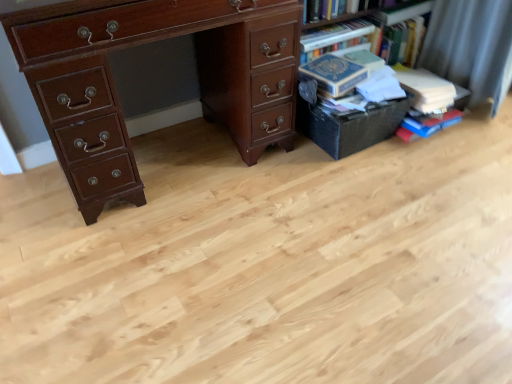
Describe the element at coordinates (350, 125) in the screenshot. This screenshot has height=384, width=512. I see `black matte box at right` at that location.

Where is `hardcover book at right, the 2th book positioned from the right`? hardcover book at right, the 2th book positioned from the right is located at coordinates (353, 77).

Can you confirm if matte brown desk at left is bigger than black matte box at right?

Yes, matte brown desk at left is bigger than black matte box at right.

Does point (6, 0) come in front of point (358, 139)?

Yes, point (6, 0) is closer to viewer.

What are the coordinates of `drawer that appears behind the matte brown desk at left` in the screenshot? It's located at (350, 125).

Is matte brown desk at left wider or thinner than black matte box at right?

Considering their sizes, matte brown desk at left looks broader than black matte box at right.

Is hardcover book at right, acting as the 1th book starting from the right, oriented away from black matte box at right?

No, hardcover book at right, acting as the 1th book starting from the right,'s orientation is not away from black matte box at right.

Between point (412, 134) and point (354, 112), which one is positioned in front?

The point (354, 112) is closer to the camera.

From a real-world perspective, which object stands above the other?

hardcover book at right, the second book viewed from the left.

Is hardcover book at right, the second book viewed from the left, touching black matte box at right?

No, hardcover book at right, the second book viewed from the left, is not touching black matte box at right.

Is the depth of hardcover books at upper right greater than that of hardcover book at right, the second book viewed from the left?

Yes, hardcover books at upper right is further from the viewer.

Is point (413, 0) farther from camera compared to point (417, 82)?

Yes, it is.

In the scene shown: From a real-world perspective, who is located higher, hardcover books at upper right or hardcover book at right, acting as the 1th book starting from the right?

From a 3D spatial view, hardcover books at upper right is above.

Are hardcover books at upper right and hardcover book at right, acting as the 1th book starting from the right, far apart?

Answer: hardcover books at upper right is near hardcover book at right, acting as the 1th book starting from the right, not far away.

Based on the photo, is hardcover books at upper right inside black matte box at right?

No.

Which of these two, black matte box at right or hardcover books at upper right, stands taller?

hardcover books at upper right.

Between point (317, 102) and point (355, 15), which one is positioned behind?

The point (355, 15) is behind.

Is black matte box at right oriented away from hardcover books at upper right?

Yes, hardcover books at upper right is at the back of black matte box at right.

Which is in front, point (315, 142) or point (408, 136)?

The point (315, 142) is more forward.

Is black matte box at right shorter than hardcover book at right, the second book viewed from the left?

No, black matte box at right is not shorter than hardcover book at right, the second book viewed from the left.

Which object is wider, black matte box at right or hardcover book at right, acting as the 1th book starting from the right?

With larger width is hardcover book at right, acting as the 1th book starting from the right.

Between black matte box at right and hardcover book at right, acting as the 1th book starting from the right, which one appears on the right side from the viewer's perspective?

hardcover book at right, acting as the 1th book starting from the right.

Is matte brown desk at left situated inside hardcover books at upper right or outside?

matte brown desk at left is outside hardcover books at upper right.

Is point (117, 139) behind point (340, 18)?

No, (117, 139) is in front of (340, 18).

Where is `the chest of drawers located below the hardcover books at upper right (from the image's perspective)`? The height and width of the screenshot is (384, 512). the chest of drawers located below the hardcover books at upper right (from the image's perspective) is located at coordinates (142, 43).

Is point (423, 106) positioned behind point (344, 102)?

That is True.

Which object is further away from the camera, hardcover book at right, acting as the 1th book starting from the right, or hardcover book at right, positioned as the first book in left-to-right order?

hardcover book at right, acting as the 1th book starting from the right.

Between hardcover book at right, the second book viewed from the left, and hardcover book at right, positioned as the first book in left-to-right order, which one has larger width?

With larger width is hardcover book at right, the second book viewed from the left.

Is hardcover book at right, acting as the 1th book starting from the right, not near hardcover book at right, positioned as the first book in left-to-right order?

They are positioned close to each other.

Image resolution: width=512 pixels, height=384 pixels. Find the location of `chest of drawers above the black matte box at right (from the image's perspective)`. chest of drawers above the black matte box at right (from the image's perspective) is located at coordinates (142, 43).

At what (x,y) coordinates should I click in order to perform the action: click on drawer located underneath the hardcover book at right, the second book viewed from the left (from a real-world perspective). Please return your answer as a coordinate pair (x, y). Looking at the image, I should click on (350, 125).

Looking at the image, which one is located closer to hardcover book at right, the second book viewed from the left, matte brown desk at left or hardcover books at upper right?

hardcover books at upper right is closer to hardcover book at right, the second book viewed from the left.

Estimate the real-world distances between objects in this image. Which object is closer to black matte box at right, hardcover books at upper right or hardcover book at right, the 2th book positioned from the right?

Among the two, hardcover book at right, the 2th book positioned from the right, is located nearer to black matte box at right.

Based on their spatial positions, is matte brown desk at left or hardcover book at right, the second book viewed from the left, further from hardcover books at upper right?

Based on the image, matte brown desk at left appears to be further to hardcover books at upper right.

Which object lies nearer to the anchor point hardcover books at upper right, hardcover book at right, the 2th book positioned from the right, or black matte box at right?

The object closer to hardcover books at upper right is hardcover book at right, the 2th book positioned from the right.

When comparing their distances from hardcover book at right, the 2th book positioned from the right, does hardcover books at upper right or hardcover book at right, the second book viewed from the left, seem closer?

Based on the image, hardcover books at upper right appears to be nearer to hardcover book at right, the 2th book positioned from the right.

Based on their spatial positions, is black matte box at right or hardcover book at right, acting as the 1th book starting from the right, further from hardcover books at upper right?

The object further to hardcover books at upper right is black matte box at right.

Based on their spatial positions, is hardcover book at right, positioned as the first book in left-to-right order, or matte brown desk at left closer to black matte box at right?

Based on the image, hardcover book at right, positioned as the first book in left-to-right order, appears to be nearer to black matte box at right.

Which object lies nearer to the anchor point black matte box at right, matte brown desk at left or hardcover book at right, acting as the 1th book starting from the right?

Among the two, hardcover book at right, acting as the 1th book starting from the right, is located nearer to black matte box at right.

Find the location of a particular element. The image size is (512, 384). drawer located between matte brown desk at left and hardcover books at upper right in the left-right direction is located at coordinates (350, 125).

Image resolution: width=512 pixels, height=384 pixels. I want to click on drawer located between matte brown desk at left and hardcover book at right, acting as the 1th book starting from the right, in the left-right direction, so click(x=350, y=125).

At what (x,y) coordinates should I click in order to perform the action: click on bookcase between hardcover book at right, positioned as the first book in left-to-right order, and hardcover book at right, acting as the 1th book starting from the right, in the horizontal direction. Please return your answer as a coordinate pair (x, y). The image size is (512, 384). Looking at the image, I should click on (376, 15).

In order to click on book between matte brown desk at left and black matte box at right in this screenshot , I will do `click(353, 77)`.